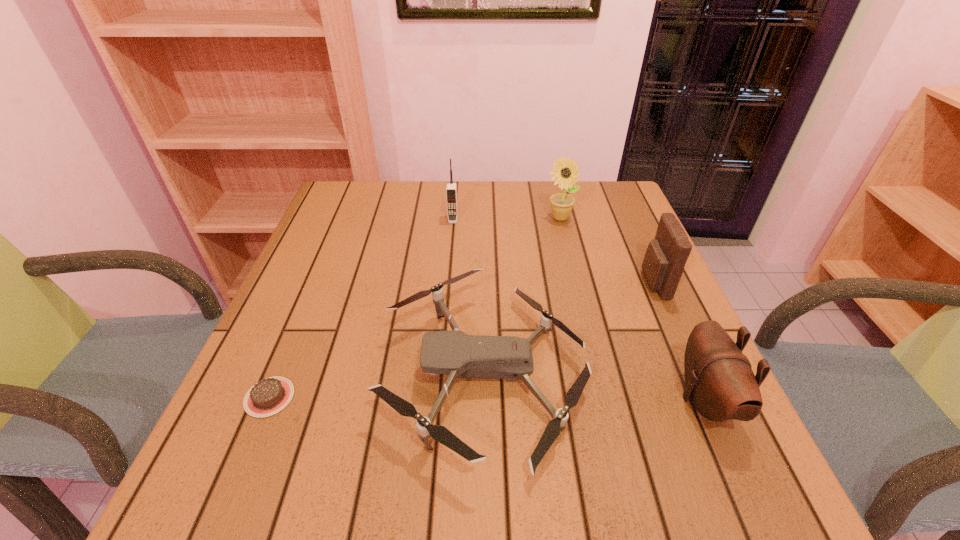
At what (x,y) coordinates should I click in order to perform the action: click on sunflower. Please return your answer as a coordinate pair (x, y). This screenshot has width=960, height=540. Looking at the image, I should click on pyautogui.click(x=565, y=173).

This screenshot has height=540, width=960. Find the location of `cellular telephone`. cellular telephone is located at coordinates (451, 190).

The width and height of the screenshot is (960, 540). Identify the location of the farther pouch. (665, 258).

Image resolution: width=960 pixels, height=540 pixels. What are the coordinates of `the nearer pouch` in the screenshot? It's located at (720, 383).

This screenshot has width=960, height=540. What are the coordinates of `drone` in the screenshot? It's located at (453, 352).

Locate an element on the screen. This screenshot has width=960, height=540. chocolate cake is located at coordinates (269, 396).

Where is `the shortest object`? The width and height of the screenshot is (960, 540). the shortest object is located at coordinates (269, 396).

Find the location of a particular element. The height and width of the screenshot is (540, 960). free space located 0.400m on the face of the sunflower is located at coordinates (588, 335).

This screenshot has width=960, height=540. What are the coordinates of `free space located 0.380m on the front-facing side of the cellular telephone` in the screenshot? It's located at (444, 325).

The width and height of the screenshot is (960, 540). Find the location of `vacant space located with an open flap on the farther pouch`. vacant space located with an open flap on the farther pouch is located at coordinates (528, 282).